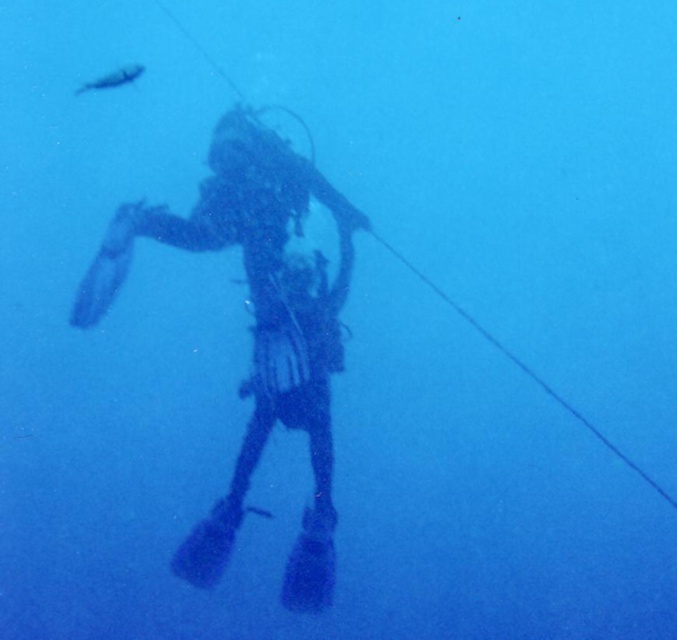
You are an underwater photographer aiming to capture the translucent blue fin at center and the shiny silver fish at upper left in the same frame. Based on their positions, which object should you adjust your camera to focus on first to ensure both are in the shot?

The translucent blue fin at center is to the left of the shiny silver fish at upper left, so you should focus on the shiny silver fish at upper left first to ensure both are in the frame.

You are a safety officer monitoring an underwater dive operation. The scuba diver is at the center of your monitor. According to the system, the black matte scuba diver at center is 5.32 meters away from you. Your safety protocol requires divers to stay within 5 meters of the surface for safety. Is the diver within the safe distance?

The black matte scuba diver at center is 5.32 meters away from the viewer, which exceeds the 5 meter safety limit. The diver is beyond the safe distance.